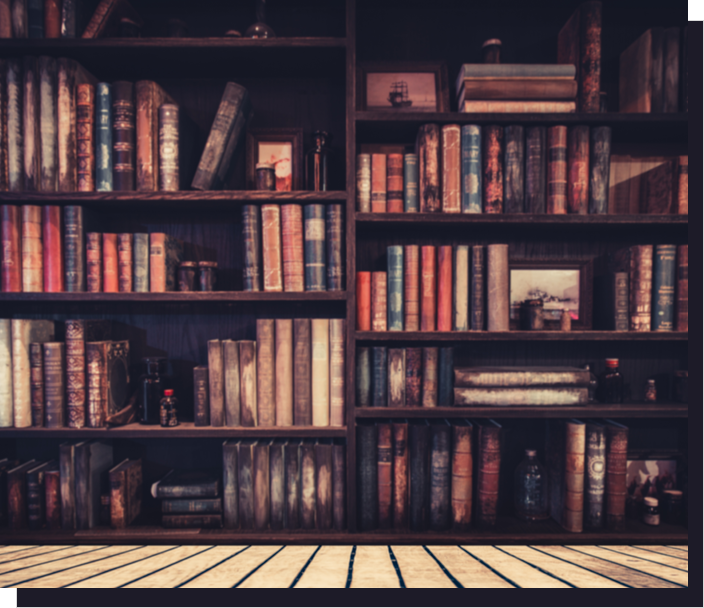
The width and height of the screenshot is (704, 608). In order to click on books on the bottom right shelf in this screenshot , I will do `click(364, 461)`, `click(382, 461)`, `click(395, 461)`, `click(414, 461)`, `click(438, 461)`, `click(460, 464)`, `click(484, 464)`, `click(567, 458)`, `click(593, 460)`, `click(614, 461)`.